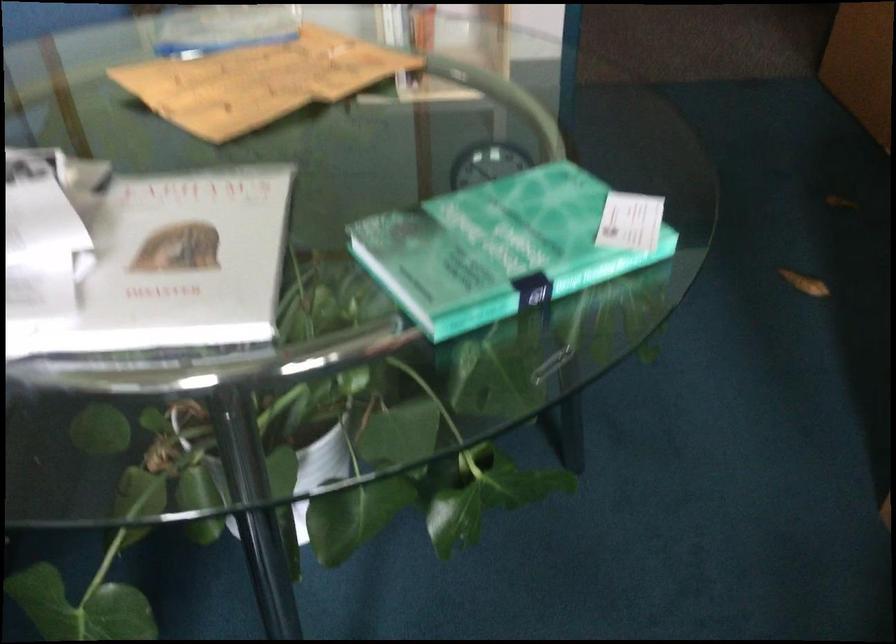
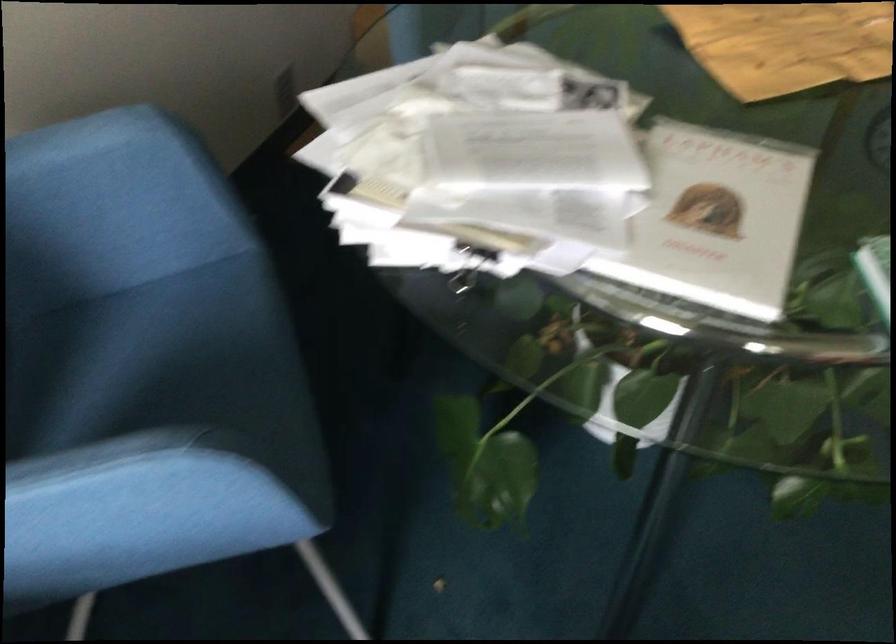
In the second image, find the point that corresponds to point (177, 251) in the first image.

(716, 220)